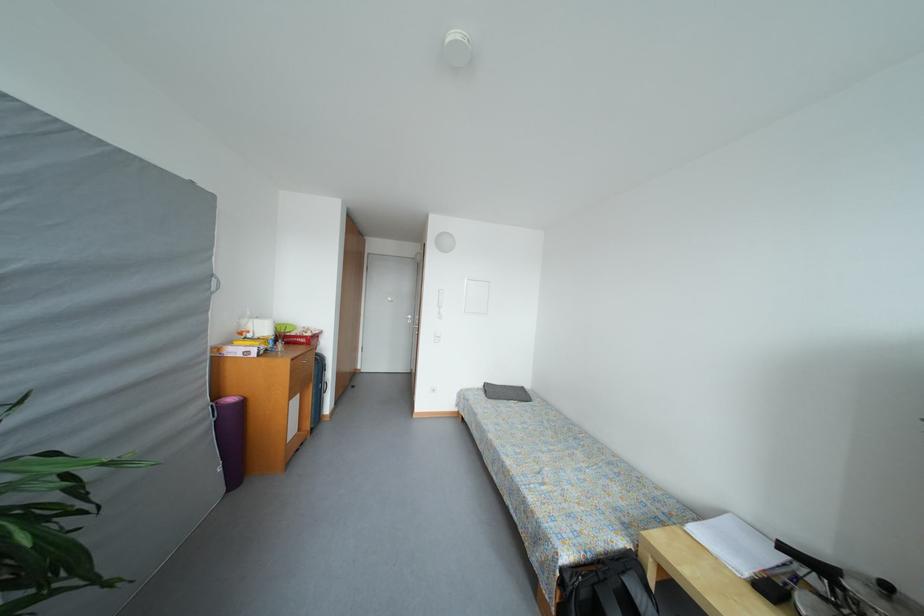
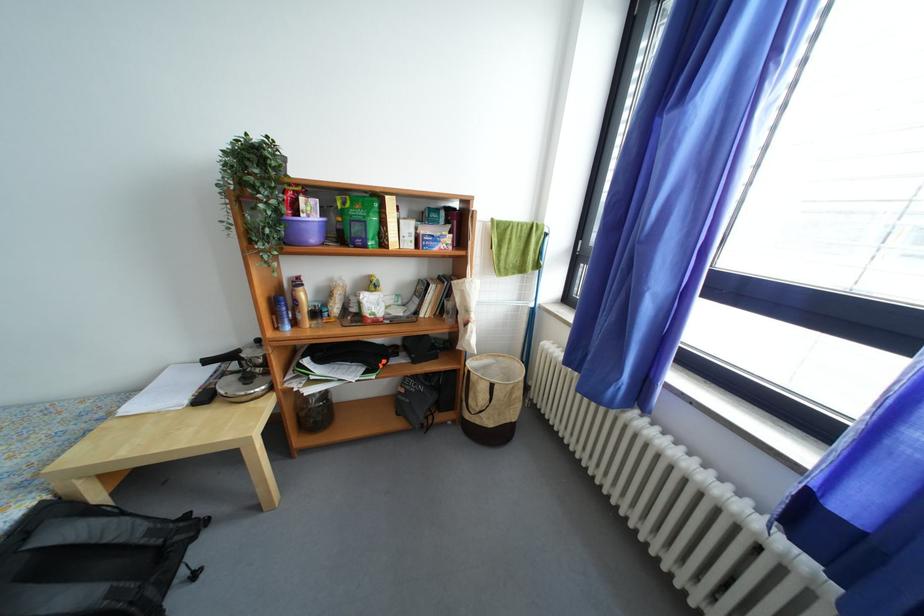
Find the pixel in the second image that matches [672,515] in the first image.

(106, 419)